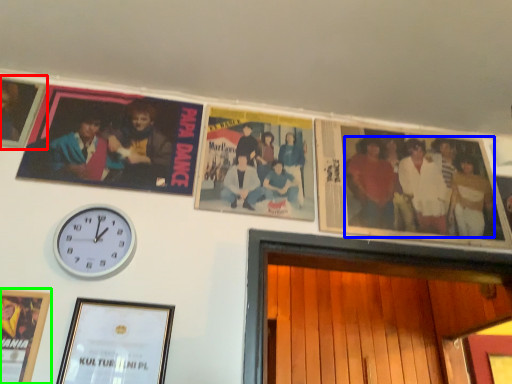
Question: Based on their relative distances, which object is nearer to picture frame (highlighted by a red box)? Choose from person (highlighted by a blue box) and picture frame (highlighted by a green box).

Choices:
 (A) person
 (B) picture frame

Answer: (B)